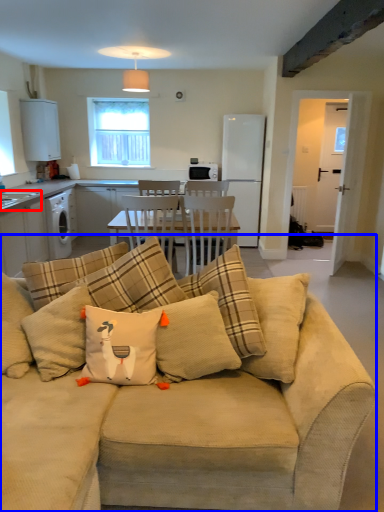
Question: Which point is closer to the camera, sink (highlighted by a red box) or studio couch (highlighted by a blue box)?

Choices:
 (A) sink
 (B) studio couch

Answer: (B)